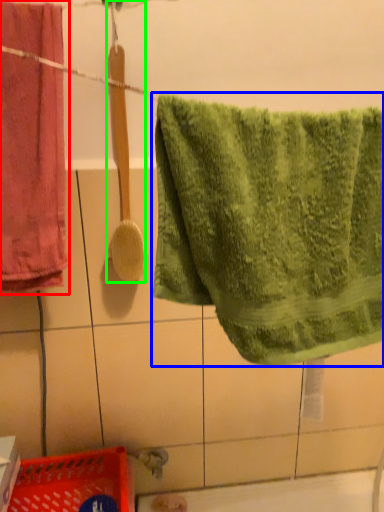
Question: Which is nearer to the towel (highlighted by a red box)? towel (highlighted by a blue box) or brush (highlighted by a green box).

Choices:
 (A) towel
 (B) brush

Answer: (B)